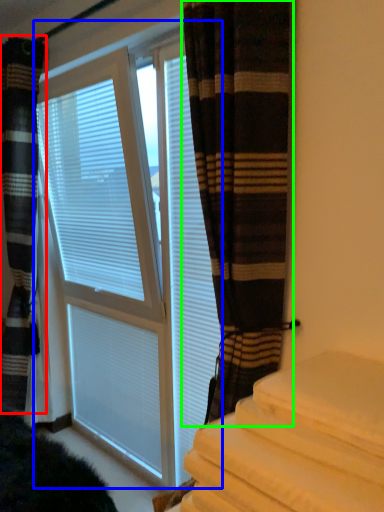
Question: Which object is positioned farthest from curtain (highlighted by a red box)? Select from bay window (highlighted by a blue box) and curtain (highlighted by a green box).

Choices:
 (A) bay window
 (B) curtain

Answer: (B)